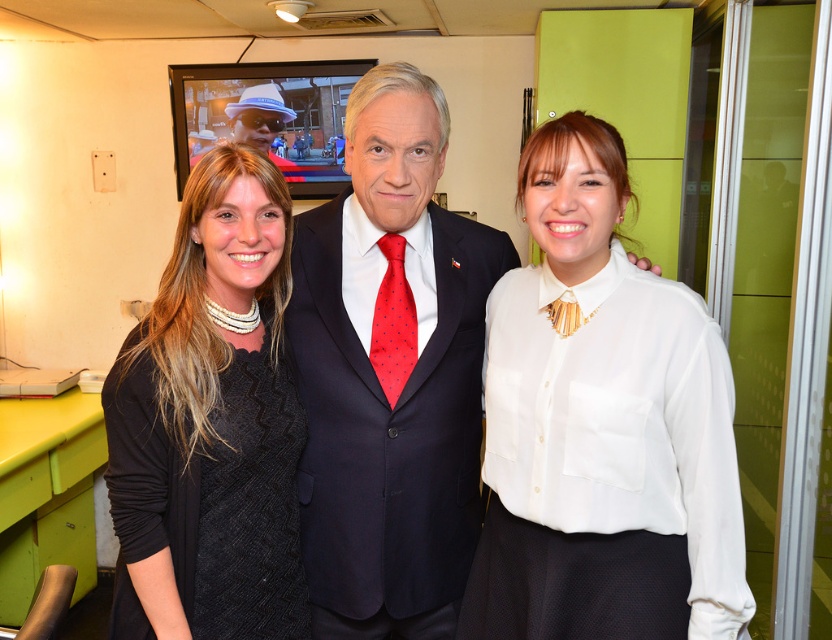
You are a photographer trying to capture the three people in the scene. The black matte dress at center is at point (379, 381). Where should you position your camera to ensure all three subjects are in frame?

The black matte dress at center is at point (379, 381), so positioning the camera centrally would ensure all three subjects are in frame.